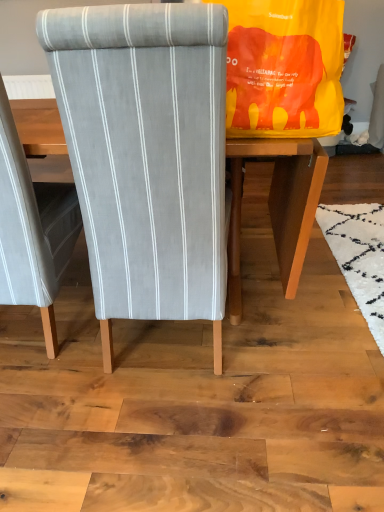
At what (x,y) coordinates should I click in order to perform the action: click on free region under gray fabric chair at center, which appears as the second chair when viewed from the left (from a real-world perspective). Please return your answer as a coordinate pair (x, y). The image size is (384, 512). Looking at the image, I should click on (167, 346).